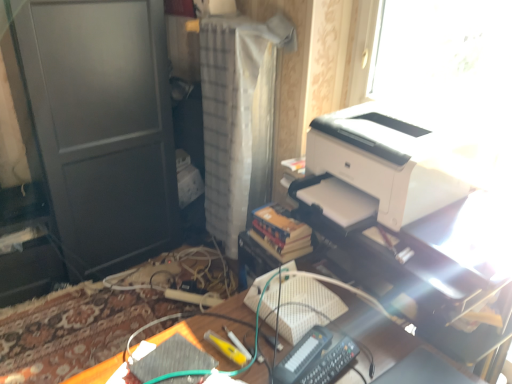
The image size is (512, 384). Find the location of `unoccupied region to the right of black plastic remote control at center`. unoccupied region to the right of black plastic remote control at center is located at coordinates (367, 345).